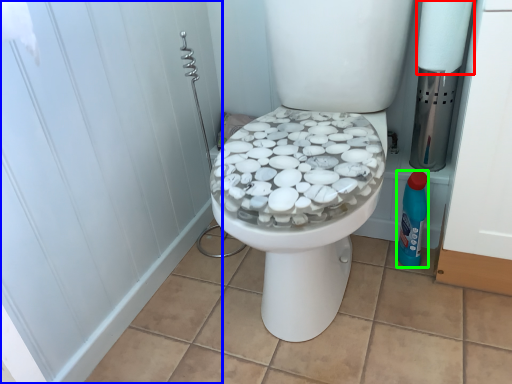
Question: Which is farther away from toilet paper (highlighted by a red box)? screen door (highlighted by a blue box) or cleaning product (highlighted by a green box)?

Choices:
 (A) screen door
 (B) cleaning product

Answer: (A)